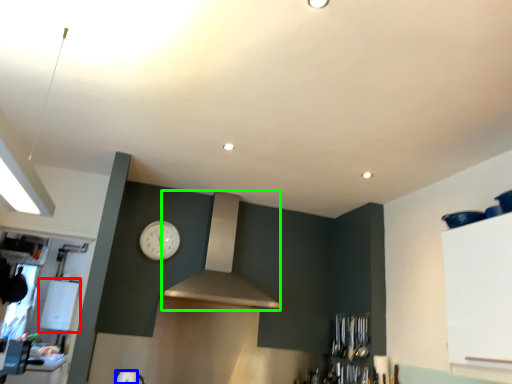
Question: Based on their relative distances, which object is farther from appliance (highlighted by a red box)? Choose from appliance (highlighted by a blue box) and vent (highlighted by a green box).

Choices:
 (A) appliance
 (B) vent

Answer: (B)